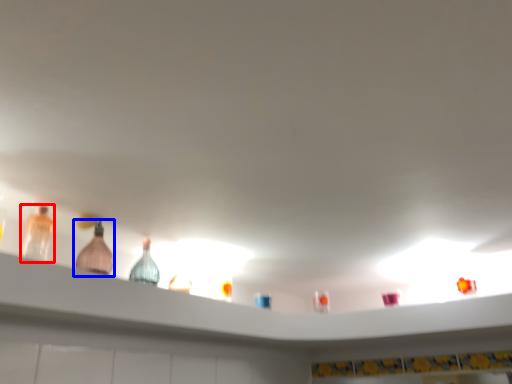
Question: Which object appears farthest to the camera in this image, bottle (highlighted by a red box) or bottle (highlighted by a blue box)?

Choices:
 (A) bottle
 (B) bottle

Answer: (B)